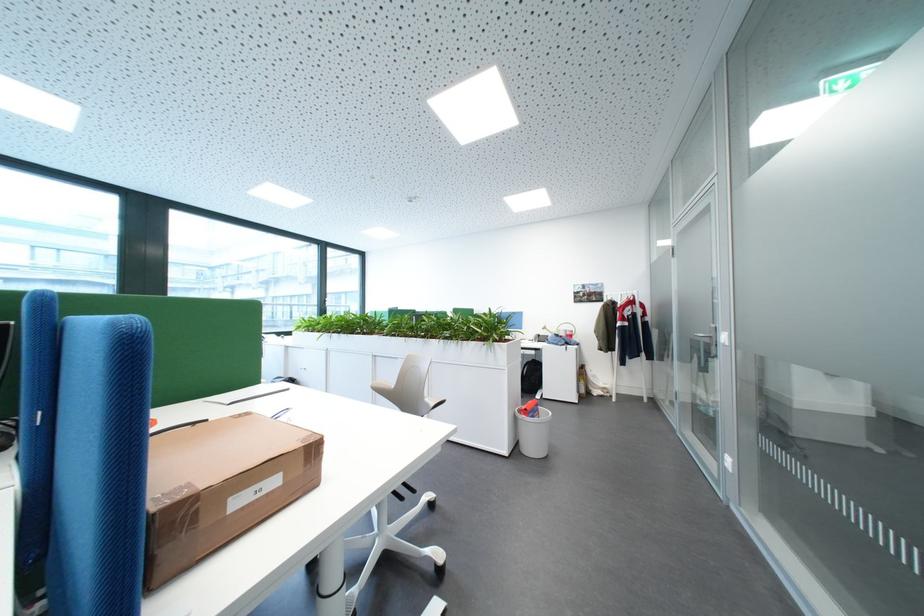
You are a GUI agent. You are given a task and a screenshot of the screen. Output one action in this format:
    pyautogui.click(x=<x>, y=<y>)
    Task: Click on the fire extinguisher handle
    The height and width of the screenshot is (616, 924).
    Given the screenshot: What is the action you would take?
    pyautogui.click(x=584, y=379)